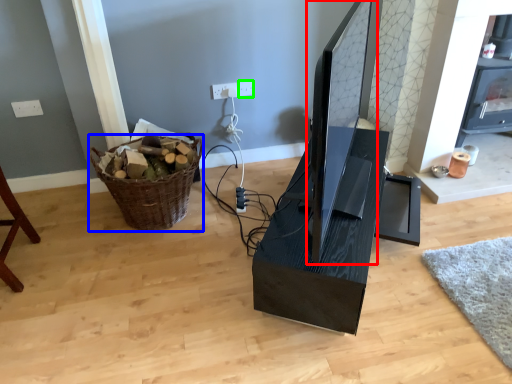
Question: Which object is the closest to the computer monitor (highlighted by a red box)? Choose among these: basket (highlighted by a blue box) or electric outlet (highlighted by a green box).

Choices:
 (A) basket
 (B) electric outlet

Answer: (B)